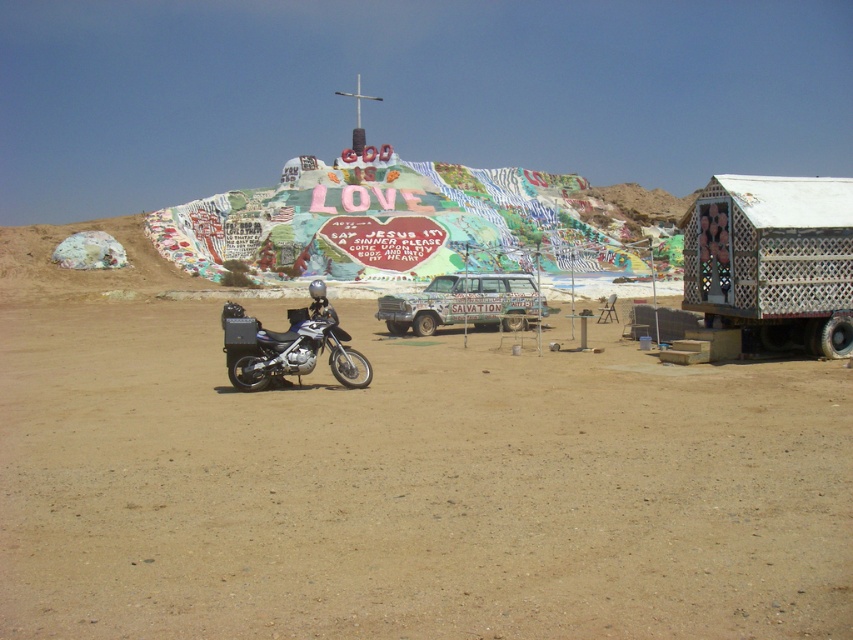
Can you confirm if brown sandy ground at center is smaller than white lattice hut at right?

No, brown sandy ground at center is not smaller than white lattice hut at right.

Is brown sandy ground at center to the right of white lattice hut at right from the viewer's perspective?

No, brown sandy ground at center is not to the right of white lattice hut at right.

Does point (546, 461) lie in front of point (830, 240)?

Yes, point (546, 461) is closer to viewer.

Find the location of a particular element. The height and width of the screenshot is (640, 853). brown sandy ground at center is located at coordinates (410, 488).

Is point (7, 497) less distant than point (506, 275)?

Yes, point (7, 497) is in front of point (506, 275).

Does brown sandy ground at center have a larger size compared to rustic wood paneling car at center?

Indeed, brown sandy ground at center has a larger size compared to rustic wood paneling car at center.

Is point (566, 612) farther from camera compared to point (397, 330)?

No.

Where is `brown sandy ground at center`? The height and width of the screenshot is (640, 853). brown sandy ground at center is located at coordinates (410, 488).

Does point (308, 346) come behind point (523, 316)?

That is False.

Can you confirm if metallic blue motorcycle at lower left is positioned to the right of rustic wood paneling car at center?

No, metallic blue motorcycle at lower left is not to the right of rustic wood paneling car at center.

Identify the location of metallic blue motorcycle at lower left. The width and height of the screenshot is (853, 640). (291, 346).